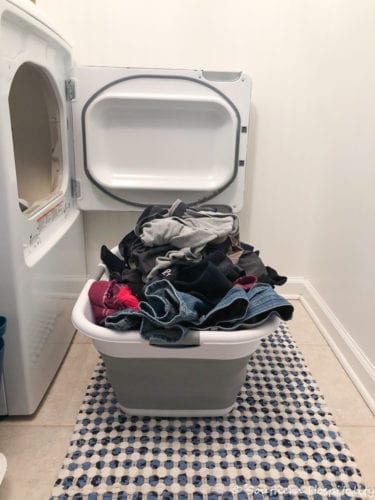
Find the location of `wall`. wall is located at coordinates (199, 42), (363, 303).